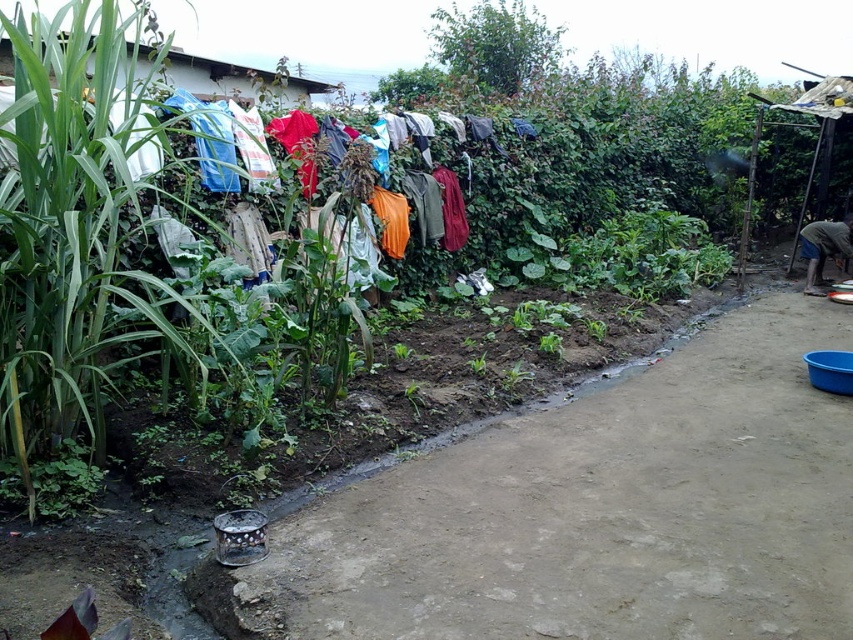
You are standing at the point marked by coordinates point (71, 232) in the image. What is the nearest object to you in the scene?

The nearest object to you at point (71, 232) is the green leafy plant at left, as the coordinates indicate its location.

You are standing on the dirt path in the garden and want to pick up the dark brown fabric at lower right. Is the green leafy plant at left blocking your path?

The green leafy plant at left has a larger size compared to dark brown fabric at lower right, so it might block your path depending on their exact positions. However, the description does not specify their horizontal alignment, so we cannot confirm if the plant is directly in the way.

You are standing at the center of the dirt path in the garden. You want to hang a new piece of clothing on the clothesline. The clothesline is at the top of the image. To reach the clothesline, you need to move in which direction relative to the dark brown fabric at lower right?

The dark brown fabric at lower right is located at the bottom edge of the image near the right side. To reach the clothesline at the top, you would need to move upward and toward the center of the image away from the dark brown fabric at lower right.